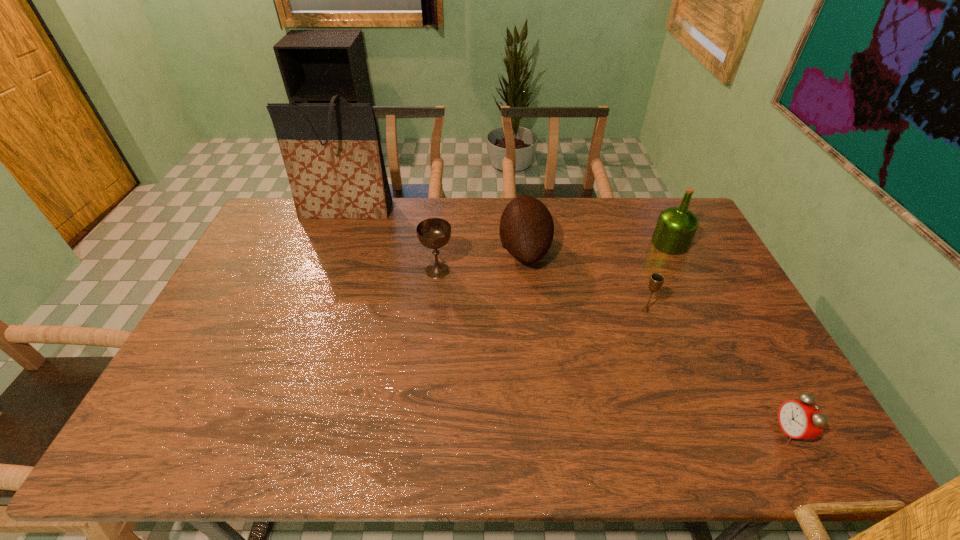
You are a GUI agent. You are given a task and a screenshot of the screen. Output one action in this format:
    pyautogui.click(x=<x>, y=<y>)
    Task: Click on the vacant space located on the front-facing side of the leftmost object
    Image resolution: width=960 pixels, height=540 pixels.
    Given the screenshot: What is the action you would take?
    pyautogui.click(x=325, y=266)

The width and height of the screenshot is (960, 540). What are the coordinates of `free space located 0.370m on the left of the olive oil` in the screenshot? It's located at (545, 244).

Locate an element on the screen. vacant space situated on the laces of the football is located at coordinates (481, 249).

Find the location of a particular element. vacant space located on the laces of the football is located at coordinates (420, 249).

Find the location of a particular element. vacant space located on the laces of the football is located at coordinates (405, 249).

Find the location of a particular element. Image resolution: width=960 pixels, height=540 pixels. vacant region located 0.380m on the left of the farther chalice is located at coordinates (304, 271).

Where is `free space located 0.290m on the front of the fifth tallest object`? This screenshot has width=960, height=540. free space located 0.290m on the front of the fifth tallest object is located at coordinates (679, 404).

Find the location of a particular element. Image resolution: width=960 pixels, height=540 pixels. vacant space located 0.110m on the front-facing side of the alarm clock is located at coordinates (731, 431).

This screenshot has width=960, height=540. What are the coordinates of `vacant area situated 0.250m on the front-facing side of the alarm clock` in the screenshot? It's located at (671, 431).

Where is `free space located 0.360m on the front-facing side of the alarm clock`? The height and width of the screenshot is (540, 960). free space located 0.360m on the front-facing side of the alarm clock is located at coordinates (625, 431).